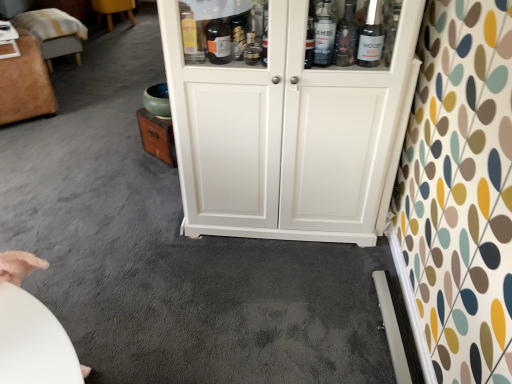
Where is `free spot in front of white wood cupboard at center`? This screenshot has height=384, width=512. free spot in front of white wood cupboard at center is located at coordinates (271, 302).